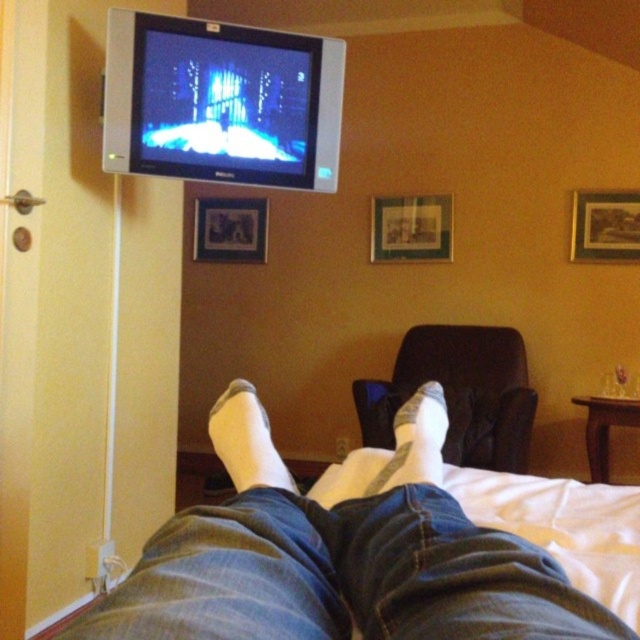
You are arranging a shelf and need to know which picture is shorter. Which is shorter between the wooden framed picture at upper right and the matte plastic picture frame at center?

The wooden framed picture at upper right is not as tall as the matte plastic picture frame at center, so the wooden framed picture at upper right is shorter.

You are standing in the room and want to place a new picture frame exactly where the wooden framed picture at upper right is currently located. What coordinates should you aim for?

The wooden framed picture at upper right is positioned at coordinates point (604, 227), so you should aim for those coordinates to place the new picture frame there.

You are standing in the room and want to place a small plant on the wall between the two points, point 1 at point (570, 618) and point 2 at point (412, 460). Which point should the plant be closer to if you want it to be nearer to you?

The plant should be placed closer to point (570, 618) because it is closer to the viewer than point (412, 460).